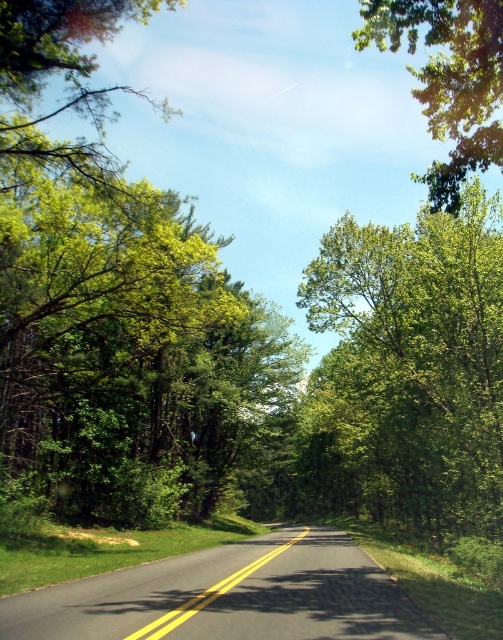
Consider the image. You are a hiker standing on the road and looking forward. Which of the two trees, the green leafy tree at center or the green leafy tree at upper right, appears taller from your perspective?

The green leafy tree at upper right appears taller than the green leafy tree at center from your perspective.

You are driving a car and see two points on the road ahead. The first point is at coordinate point [409,429] and the second point is at coordinate point [492,48]. Which point is closer to your current position?

Point [492,48] is closer to your current position because it is less further to the camera than point [409,429].

You are driving along the road and see the green leafy tree at center and the green leafy tree at upper right. Which tree is closer to the road?

The green leafy tree at center is closer to the road because it is located below the green leafy tree at upper right, indicating it is positioned lower in the image and thus nearer to the road surface.